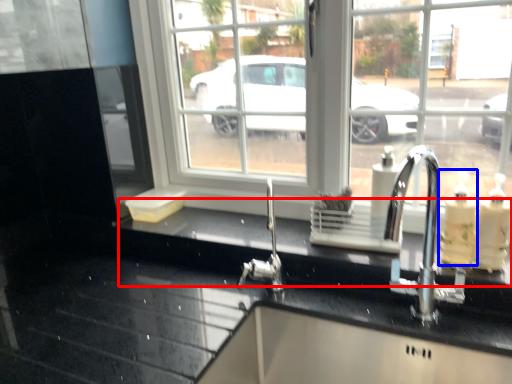
Question: Among these objects, which one is nearest to the camera, counter top (highlighted by a red box) or soap dispenser (highlighted by a blue box)?

Choices:
 (A) counter top
 (B) soap dispenser

Answer: (A)